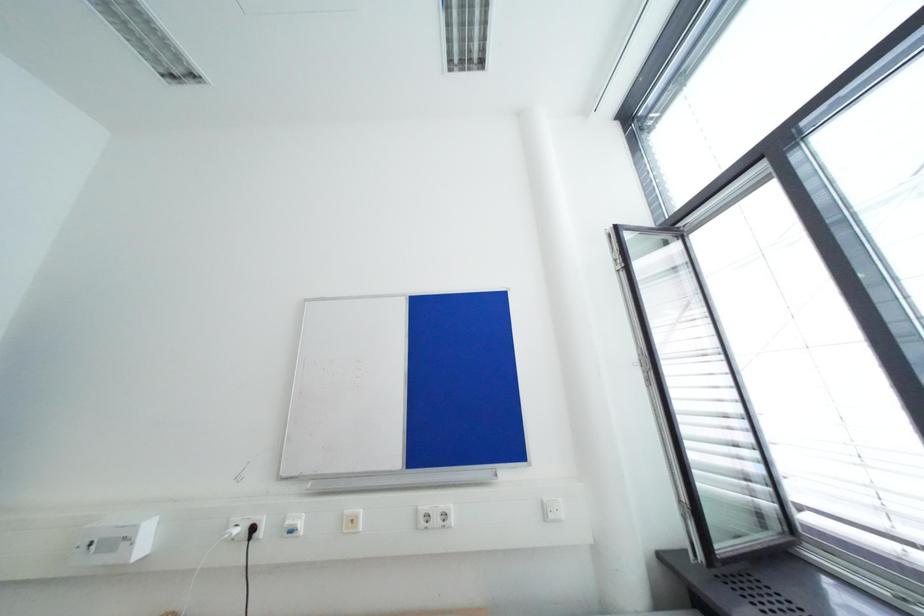
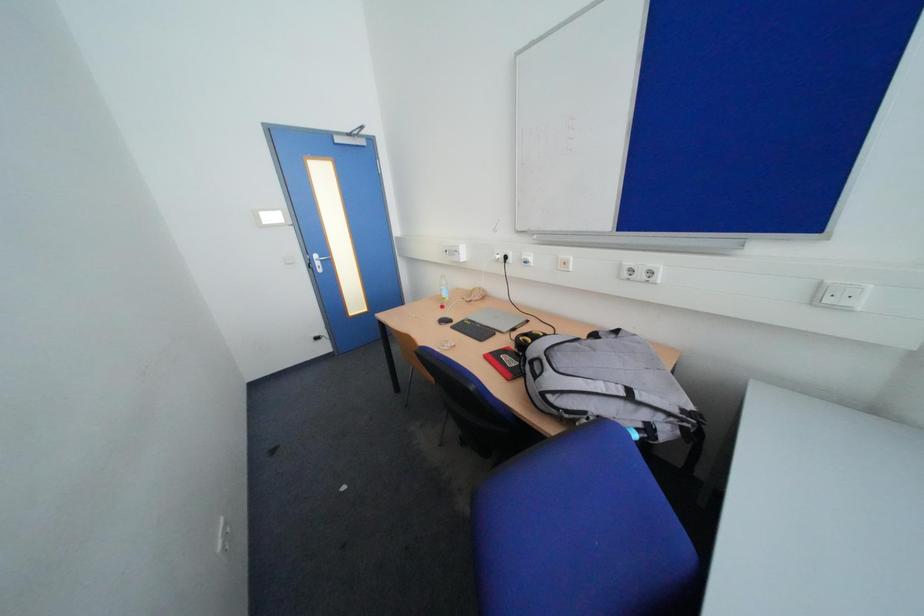
How did the camera likely rotate?

The camera rotated toward left-down.